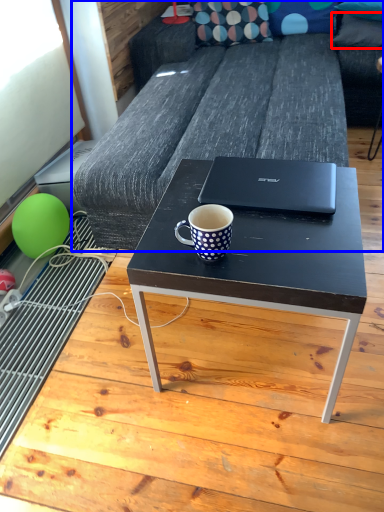
Question: Which of the following is the closest to the observer, pillow (highlighted by a red box) or studio couch (highlighted by a blue box)?

Choices:
 (A) pillow
 (B) studio couch

Answer: (B)